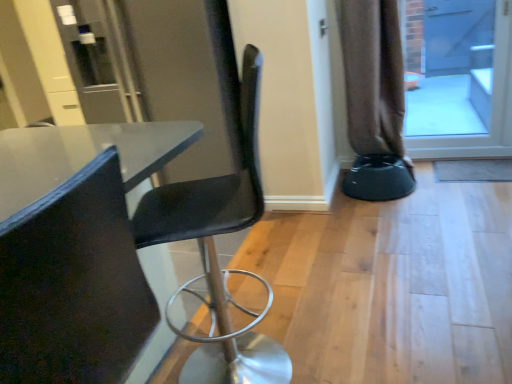
Question: Does point coord(252,152) appear closer or farther from the camera than point coord(493,122)?

Choices:
 (A) farther
 (B) closer

Answer: (B)

Question: From the image's perspective, is matte black chair at center, arranged as the first chair when viewed from the back, above or below blue glass screen door at upper right?

Choices:
 (A) above
 (B) below

Answer: (B)

Question: Which is nearer to the brown fabric curtain at right?

Choices:
 (A) blue glass screen door at upper right
 (B) matte black chair at center, which is the second chair in front-to-back order
 (C) matte black chair at left, which is the first chair in front-to-back order
 (D) black plastic bar stool at lower right

Answer: (D)

Question: Which object is the closest to the matte black chair at center, arranged as the first chair when viewed from the back?

Choices:
 (A) black plastic bar stool at lower right
 (B) blue glass screen door at upper right
 (C) matte black chair at left, which is the first chair in front-to-back order
 (D) brown fabric curtain at right

Answer: (C)